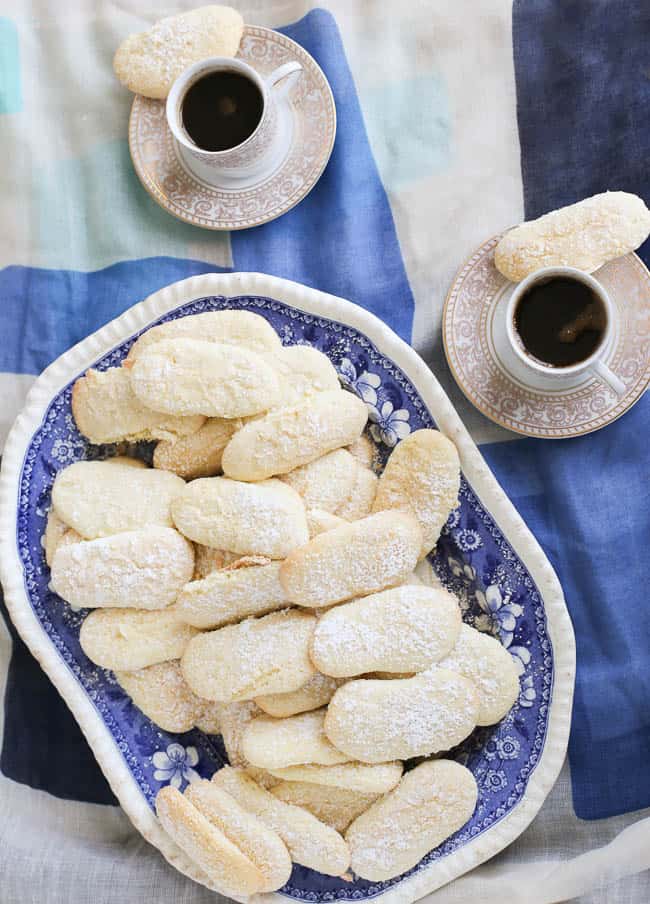
I want to click on teacup plate, so click(299, 173), click(484, 378).